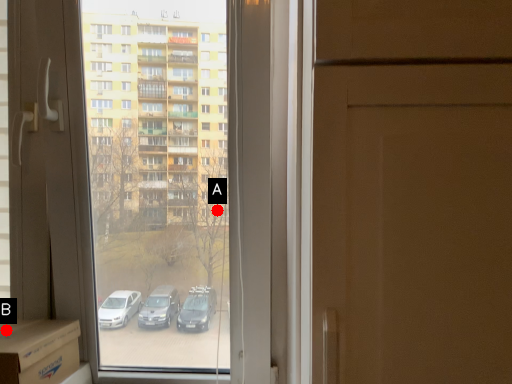
Question: Two points are circled on the image, labeled by A and B beside each circle. Among these points, which one is nearest to the camera?

Choices:
 (A) A is closer
 (B) B is closer

Answer: (B)